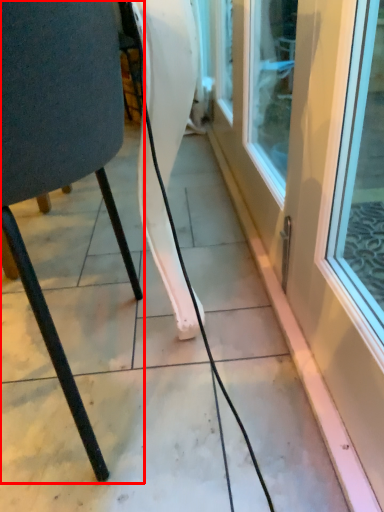
Question: From the image's perspective, where is chair (annotated by the red box) located in relation to door in the image?

Choices:
 (A) above
 (B) below

Answer: (B)